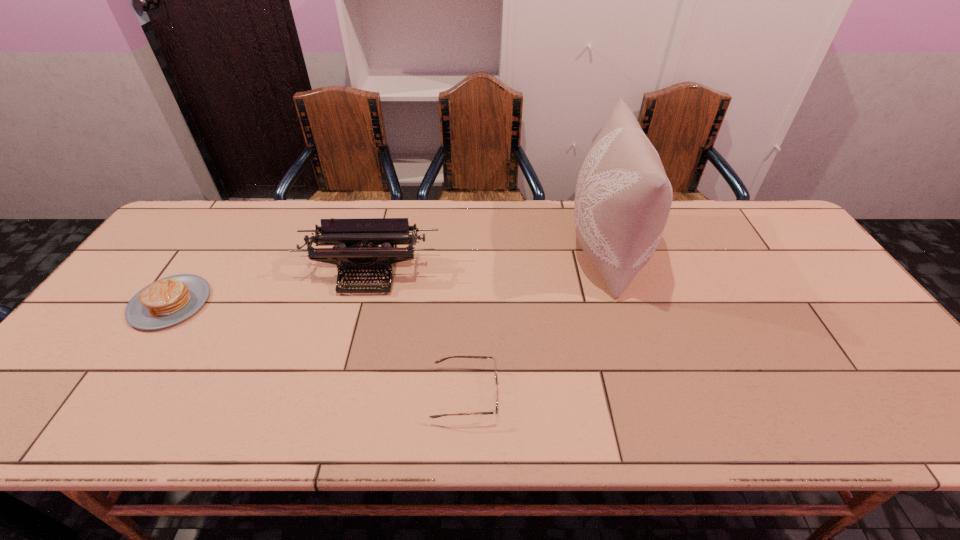
What are the coordinates of `the rightmost object` in the screenshot? It's located at tap(623, 197).

At what (x,y) coordinates should I click in order to perform the action: click on cushion. Please return your answer as a coordinate pair (x, y). Looking at the image, I should click on (623, 197).

At what (x,y) coordinates should I click in order to perform the action: click on the second tallest object. Please return your answer as a coordinate pair (x, y). The image size is (960, 540). Looking at the image, I should click on (355, 251).

At what (x,y) coordinates should I click in order to perform the action: click on the third object from right to left. Please return your answer as a coordinate pair (x, y). This screenshot has width=960, height=540. Looking at the image, I should click on (355, 251).

Where is `the leftmost object`? This screenshot has width=960, height=540. the leftmost object is located at coordinates (170, 300).

Locate an element on the screen. The height and width of the screenshot is (540, 960). the nearest object is located at coordinates (496, 395).

Image resolution: width=960 pixels, height=540 pixels. Identify the location of the second object from right to left. (496, 395).

Where is `vacant position located 0.240m on the front side of the cushion`? This screenshot has height=540, width=960. vacant position located 0.240m on the front side of the cushion is located at coordinates (489, 251).

At what (x,y) coordinates should I click in order to perform the action: click on vacant region located 0.380m on the front side of the cushion. Please return your answer as a coordinate pair (x, y). Looking at the image, I should click on (442, 251).

Find the location of `vacant space located on the front side of the cushion`. vacant space located on the front side of the cushion is located at coordinates (551, 251).